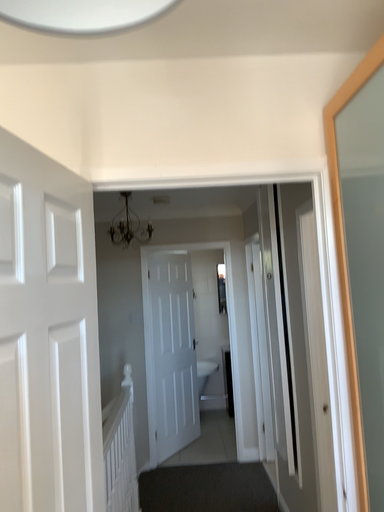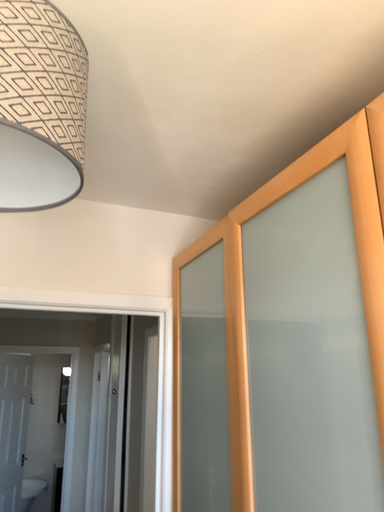
Question: Which way did the camera rotate in the video?

Choices:
 (A) rotated left
 (B) rotated right

Answer: (B)